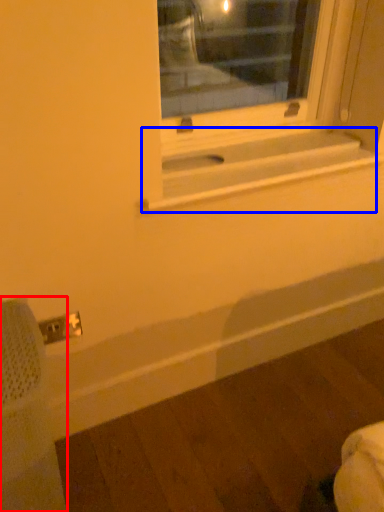
Question: Which object appears farthest to the camera in this image, swivel chair (highlighted by a red box) or window sill (highlighted by a blue box)?

Choices:
 (A) swivel chair
 (B) window sill

Answer: (B)